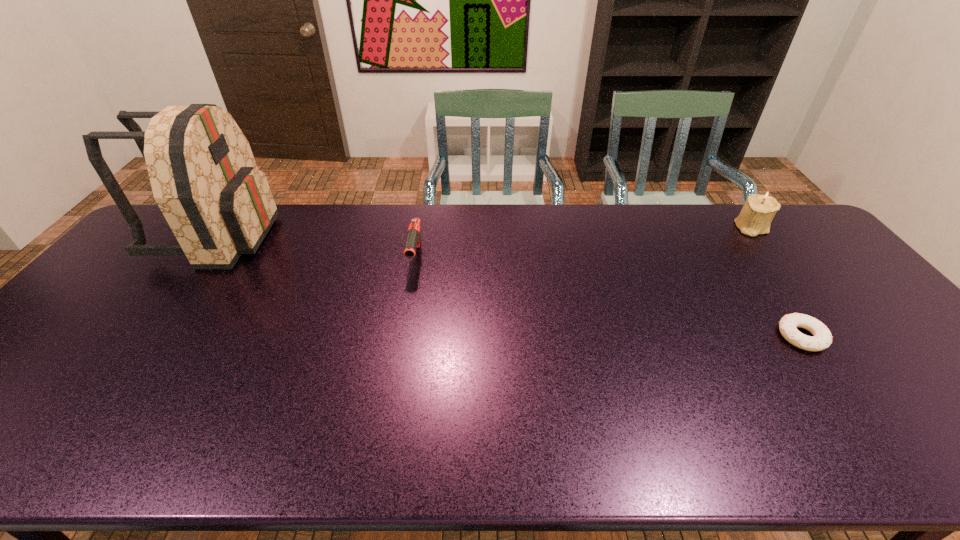
The height and width of the screenshot is (540, 960). In order to click on vacant space that's between the tallest object and the gun in this screenshot , I will do `click(317, 247)`.

The width and height of the screenshot is (960, 540). I want to click on free space between the shortest object and the third object from right to left, so click(x=609, y=297).

Select which object appears as the closest to the third object from right to left. Please provide its 2D coordinates. Your answer should be formatted as a tuple, i.e. [(x, y)], where the tuple contains the x and y coordinates of a point satisfying the conditions above.

[(204, 178)]

Where is `the third closest object relative to the doughnut`? The height and width of the screenshot is (540, 960). the third closest object relative to the doughnut is located at coordinates (204, 178).

This screenshot has height=540, width=960. I want to click on free location that satisfies the following two spatial constraints: 1. at the aiming end of the gun; 2. on the left side of the shortest object, so click(x=402, y=336).

Locate an element on the screen. vacant space that satisfies the following two spatial constraints: 1. on the back side of the nearest object; 2. on the front face of the tallest object is located at coordinates (731, 235).

Where is `free spot that satisfies the following two spatial constraints: 1. on the front face of the backpack; 2. on the left side of the nearest object`? This screenshot has width=960, height=540. free spot that satisfies the following two spatial constraints: 1. on the front face of the backpack; 2. on the left side of the nearest object is located at coordinates (144, 336).

Where is `free space that satisfies the following two spatial constraints: 1. on the front face of the leftmost object; 2. on the back side of the doughnut`? free space that satisfies the following two spatial constraints: 1. on the front face of the leftmost object; 2. on the back side of the doughnut is located at coordinates (144, 336).

Where is `vacant space that satisfies the following two spatial constraints: 1. on the front side of the third shortest object; 2. on the front face of the backpack`? The width and height of the screenshot is (960, 540). vacant space that satisfies the following two spatial constraints: 1. on the front side of the third shortest object; 2. on the front face of the backpack is located at coordinates (758, 235).

Where is `vacant space that satisfies the following two spatial constraints: 1. on the front face of the tallest object; 2. on the back side of the shortest object`? vacant space that satisfies the following two spatial constraints: 1. on the front face of the tallest object; 2. on the back side of the shortest object is located at coordinates (144, 336).